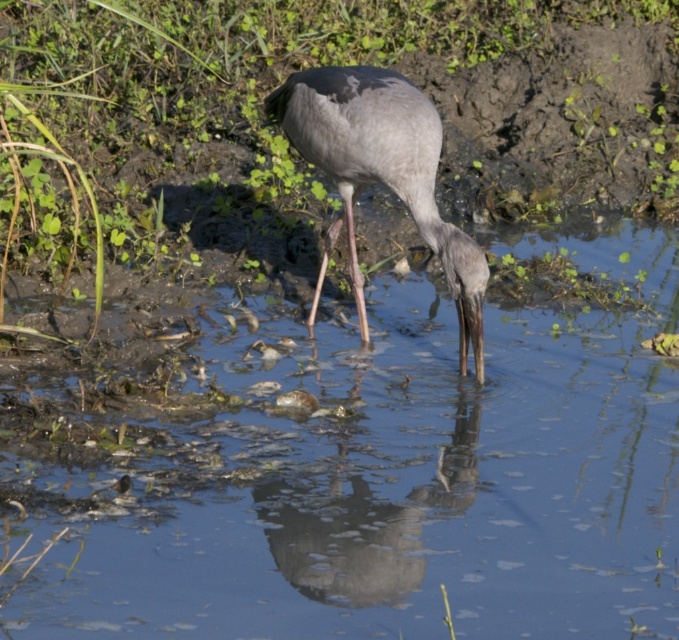
Which is below, clear water at center or gray matte bird at center?

clear water at center is lower down.

Does clear water at center have a greater width compared to gray matte bird at center?

Yes, clear water at center is wider than gray matte bird at center.

Who is more forward, [570,387] or [278,99]?

Point [278,99] is more forward.

Image resolution: width=679 pixels, height=640 pixels. Identify the location of clear water at center. (388, 481).